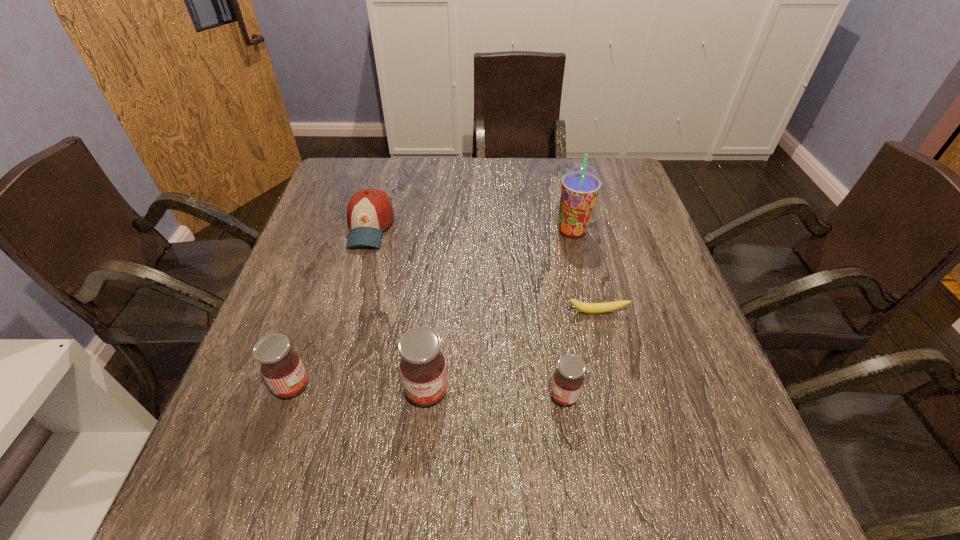
Locate an element on the screen. object that is at the near left corner is located at coordinates (280, 365).

In the image, there is a desktop. Where is `vacant space at the far edge`? The image size is (960, 540). vacant space at the far edge is located at coordinates (416, 172).

I want to click on free region at the near edge of the desktop, so click(x=343, y=417).

You are a GUI agent. You are given a task and a screenshot of the screen. Output one action in this format:
    pyautogui.click(x=<x>, y=<y>)
    Task: Click on the vacant space at the left edge of the desktop
    Image resolution: width=960 pixels, height=540 pixels.
    Given the screenshot: What is the action you would take?
    pyautogui.click(x=318, y=223)

Where is `free spot at the right edge of the desktop`? free spot at the right edge of the desktop is located at coordinates (597, 228).

The width and height of the screenshot is (960, 540). What are the coordinates of `free space at the far left corner` in the screenshot? It's located at (343, 169).

You are a GUI agent. You are given a task and a screenshot of the screen. Output one action in this format:
    pyautogui.click(x=<x>, y=<y>)
    Task: Click on the free space at the near left corner of the desktop
    The width and height of the screenshot is (960, 540).
    Given the screenshot: What is the action you would take?
    pyautogui.click(x=256, y=423)

Where is `free region at the far right corner`? This screenshot has width=960, height=540. free region at the far right corner is located at coordinates (x=591, y=160).

Identify the location of free location at the near right corner. This screenshot has height=540, width=960. (727, 443).

Image resolution: width=960 pixels, height=540 pixels. In order to click on vacant area that lies between the smoothie and the baseball cap in this screenshot , I will do `click(471, 229)`.